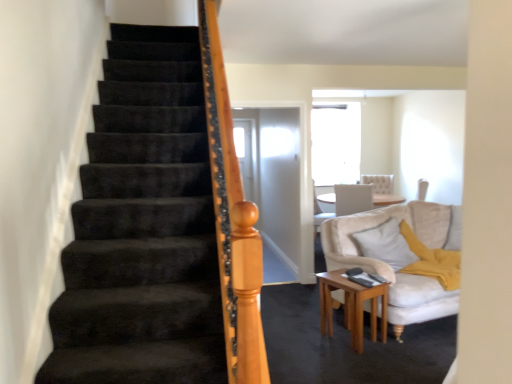
Question: From the image's perspective, is soft white pillow at right positioned above or below light brown wooden side table at lower right?

Choices:
 (A) below
 (B) above

Answer: (B)

Question: In terms of width, does soft white pillow at right look wider or thinner when compared to light brown wooden side table at lower right?

Choices:
 (A) thin
 (B) wide

Answer: (A)

Question: Relative to light brown wooden side table at lower right, is soft white pillow at right in front or behind?

Choices:
 (A) behind
 (B) front

Answer: (A)

Question: Based on their sizes in the image, would you say light brown wooden side table at lower right is bigger or smaller than soft white pillow at right?

Choices:
 (A) small
 (B) big

Answer: (A)

Question: From the image's perspective, is light brown wooden side table at lower right above or below soft white pillow at right?

Choices:
 (A) below
 (B) above

Answer: (A)

Question: Is light brown wooden side table at lower right wider or thinner than soft white pillow at right?

Choices:
 (A) thin
 (B) wide

Answer: (B)

Question: Relative to soft white pillow at right, is light brown wooden side table at lower right in front or behind?

Choices:
 (A) front
 (B) behind

Answer: (A)